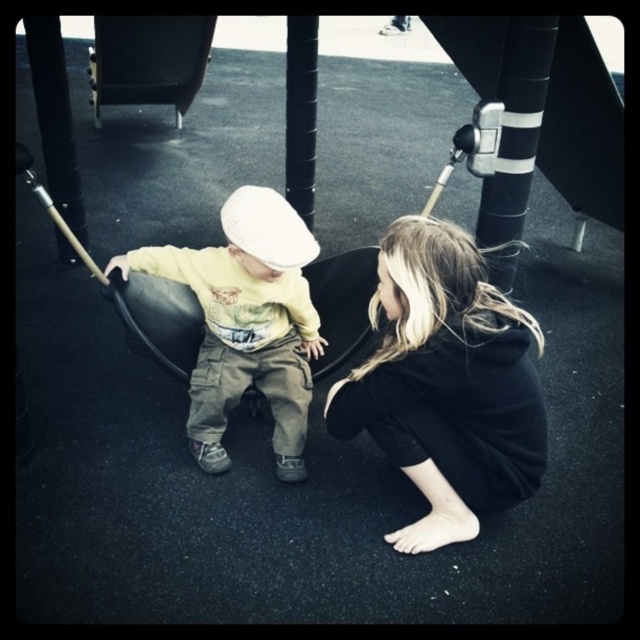
Looking at this image, is black soft hair at lower center above matte yellow shirt at center?

Incorrect, black soft hair at lower center is not positioned above matte yellow shirt at center.

Is black soft hair at lower center positioned at the back of matte yellow shirt at center?

No.

Does point (442, 349) come in front of point (218, 422)?

Yes, it is in front of point (218, 422).

Image resolution: width=640 pixels, height=640 pixels. In order to click on black soft hair at lower center in this screenshot , I will do `click(445, 384)`.